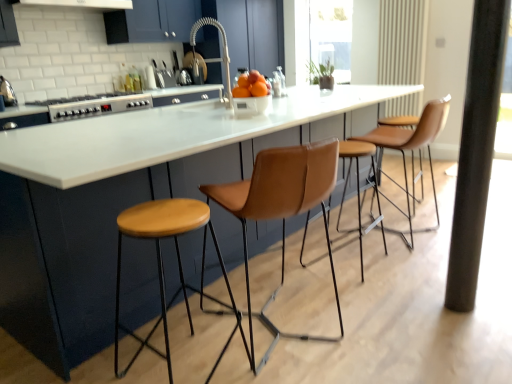
This screenshot has height=384, width=512. I want to click on vacant region to the left of black matte pillar at right, so click(423, 302).